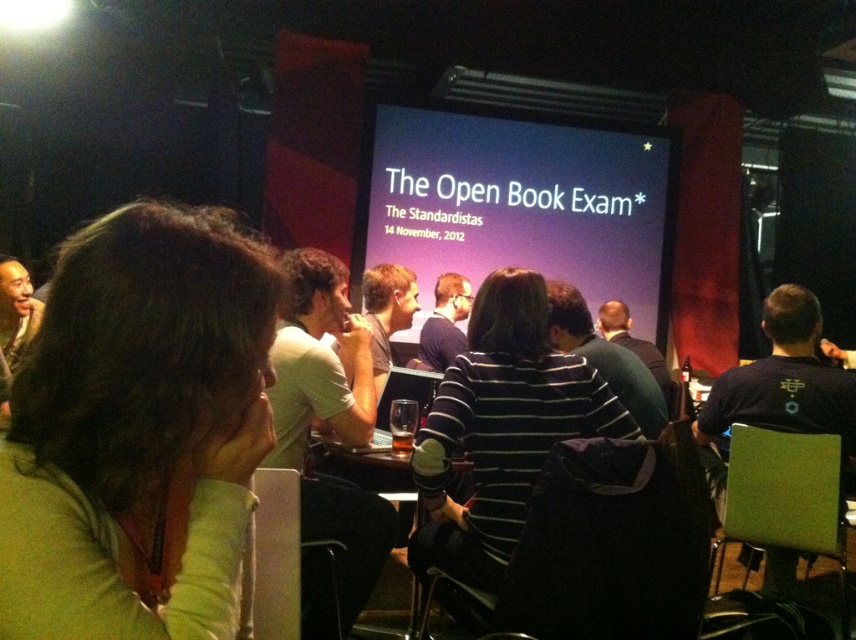
You are a photographer taking a photo of the two shirts in the image. The green fabric shirt at lower left and the white shirt at center. Which shirt should you focus on to ensure the other is in the background?

You should focus on the green fabric shirt at lower left because it is closer to the viewer than the white shirt at center, so focusing on it will place the white shirt at center in the background.

In the scene shown: You are an attendee sitting in the back row of the conference room. You notice two purple matte items at the center of the room. Which one is positioned higher, the purple matte screen at center or the purple matte shirt at center?

The purple matte screen at center is located above the purple matte shirt at center, so the screen is positioned higher.